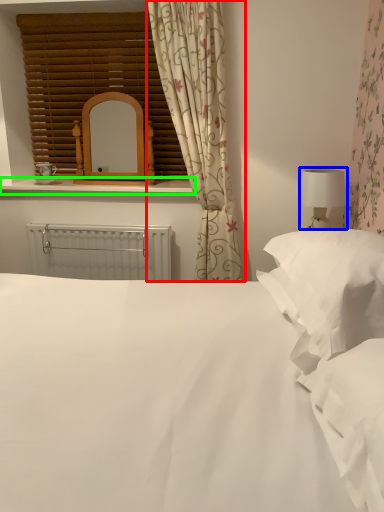
Question: Which object is positioned closest to curtain (highlighted by a red box)? Select from table lamp (highlighted by a blue box) and window sill (highlighted by a green box).

Choices:
 (A) table lamp
 (B) window sill

Answer: (B)